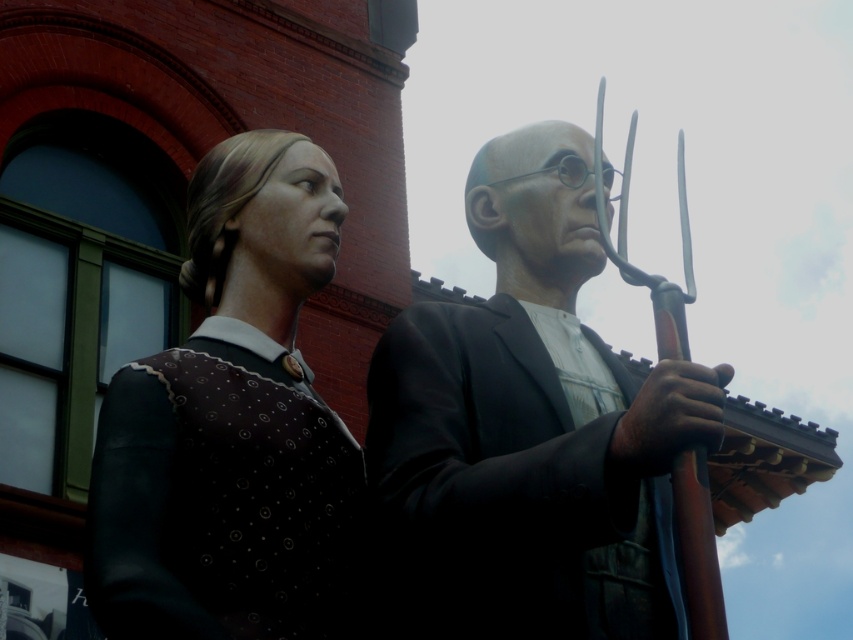
Where is `matte black suit at center`? matte black suit at center is located at coordinates (531, 428).

Does matte black suit at center have a smaller size compared to matte brown vest at left?

Actually, matte black suit at center might be larger than matte brown vest at left.

I want to click on matte black suit at center, so click(x=531, y=428).